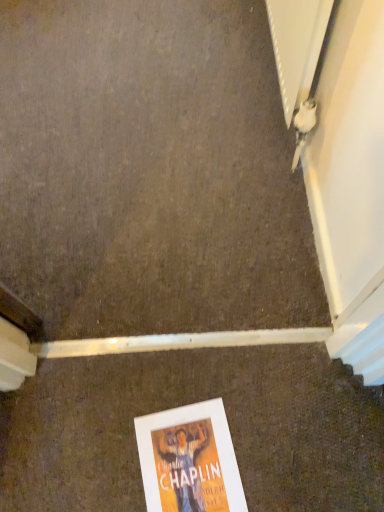
Question: Should I look upward or downward to see orange paper poster at lower center?

Choices:
 (A) up
 (B) down

Answer: (B)